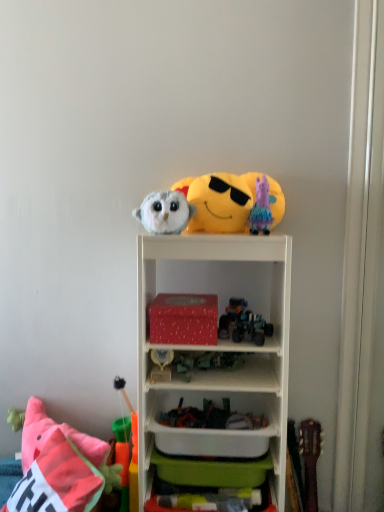
Question: Does yellow plush emoji at upper center, positioned as the 8th toy in bottom-to-top order, come behind white plastic shelf at upper center?

Choices:
 (A) yes
 (B) no

Answer: (A)

Question: Can you confirm if yellow plush emoji at upper center, positioned as the 8th toy in bottom-to-top order, is wider than white plastic shelf at upper center?

Choices:
 (A) yes
 (B) no

Answer: (B)

Question: Can you confirm if yellow plush emoji at upper center, which is the 1th toy in top-to-bottom order, is positioned to the left of white plastic shelf at upper center?

Choices:
 (A) yes
 (B) no

Answer: (B)

Question: Is yellow plush emoji at upper center, positioned as the 8th toy in bottom-to-top order, surrounding white plastic shelf at upper center?

Choices:
 (A) yes
 (B) no

Answer: (B)

Question: From a real-world perspective, is yellow plush emoji at upper center, which is the 1th toy in top-to-bottom order, beneath white plastic shelf at upper center?

Choices:
 (A) no
 (B) yes

Answer: (A)

Question: From the image's perspective, is yellow plush emoji at upper center, which is the 1th toy in top-to-bottom order, beneath white plastic shelf at upper center?

Choices:
 (A) no
 (B) yes

Answer: (A)

Question: Are shiny metallic robot at center, positioned as the 5th toy in bottom-to-top order, and black plastic toy at lower left, the second toy positioned from the bottom, making contact?

Choices:
 (A) no
 (B) yes

Answer: (A)

Question: From the image's perspective, is shiny metallic robot at center, placed as the 4th toy when sorted from top to bottom, under black plastic toy at lower left, which is the 7th toy from top to bottom?

Choices:
 (A) yes
 (B) no

Answer: (B)

Question: From a real-world perspective, is shiny metallic robot at center, placed as the 4th toy when sorted from top to bottom, on top of black plastic toy at lower left, the second toy positioned from the bottom?

Choices:
 (A) no
 (B) yes

Answer: (B)

Question: Can you confirm if shiny metallic robot at center, positioned as the 5th toy in bottom-to-top order, is shorter than black plastic toy at lower left, the second toy positioned from the bottom?

Choices:
 (A) no
 (B) yes

Answer: (B)

Question: Does shiny metallic robot at center, positioned as the 5th toy in bottom-to-top order, lie behind black plastic toy at lower left, which is the 7th toy from top to bottom?

Choices:
 (A) yes
 (B) no

Answer: (B)

Question: Is shiny metallic robot at center, placed as the 4th toy when sorted from top to bottom, aimed at black plastic toy at lower left, which is the 7th toy from top to bottom?

Choices:
 (A) yes
 (B) no

Answer: (B)

Question: Are shiny metallic car at center, the fifth toy when ordered from top to bottom, and fluffy pink pillow at lower left located far from each other?

Choices:
 (A) yes
 (B) no

Answer: (B)